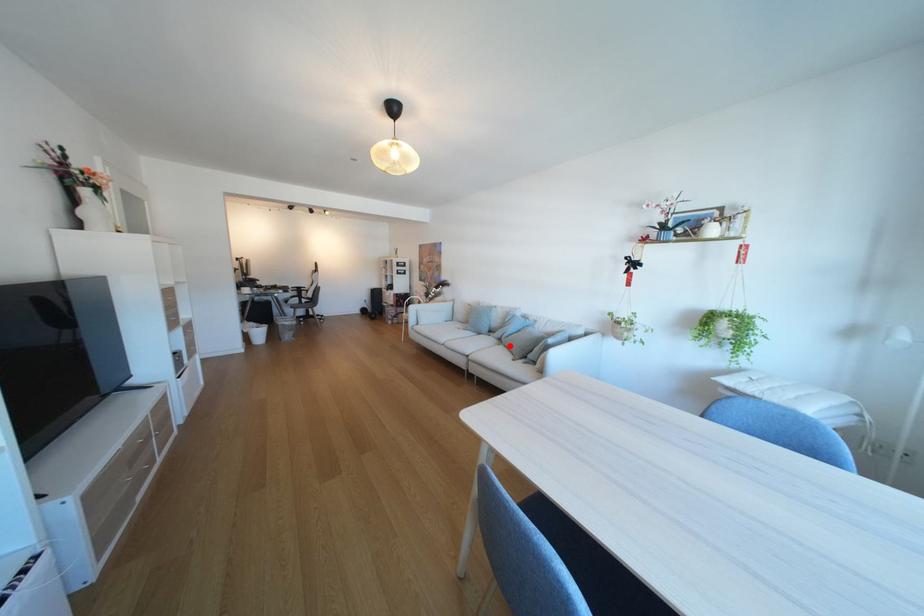
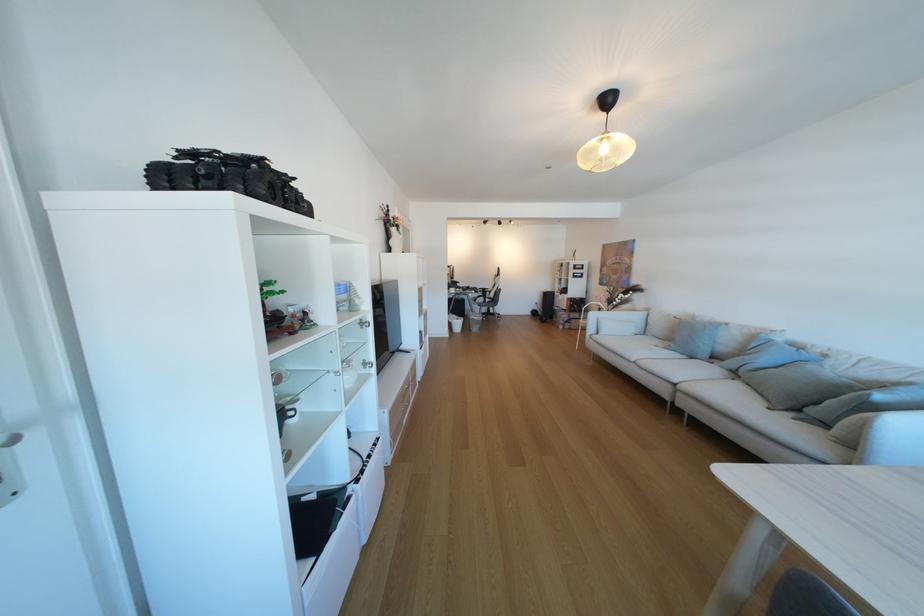
The point at the highlighted location is marked in the first image. Where is the corresponding point in the second image?

(745, 381)